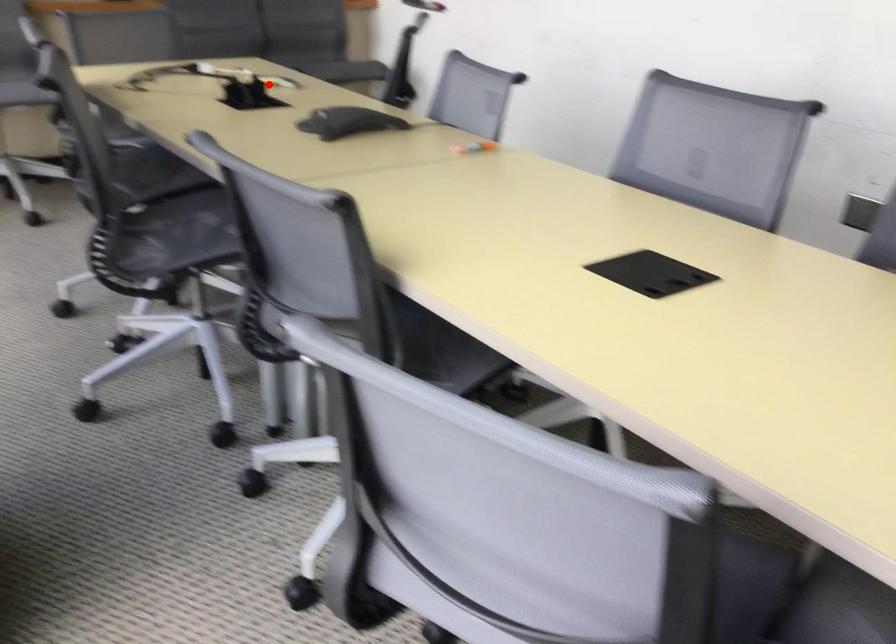
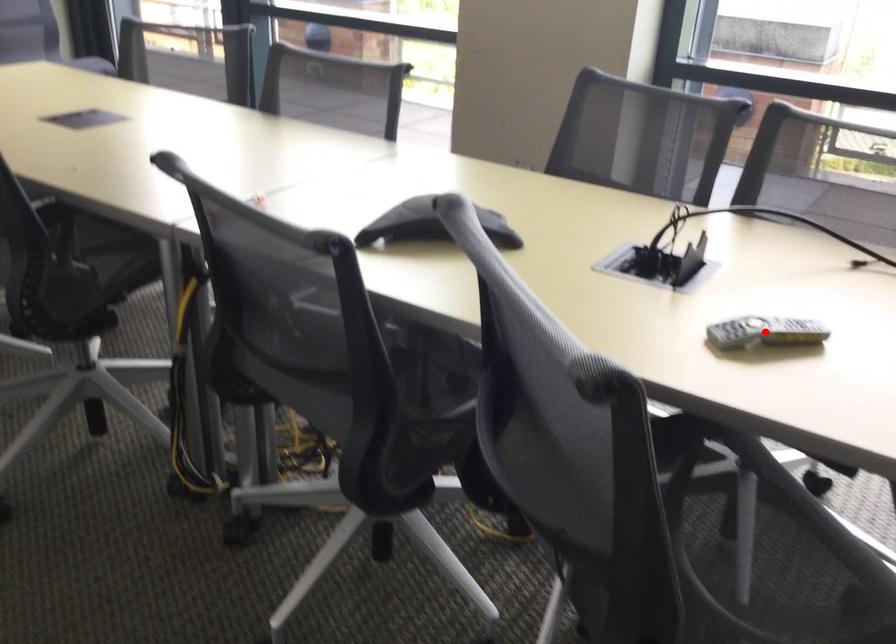
I am providing you with two images of the same scene from different viewpoints. A red point is marked on the first image and another point is marked on the second image. Is the red point in image1 aligned with the point shown in image2?

Yes